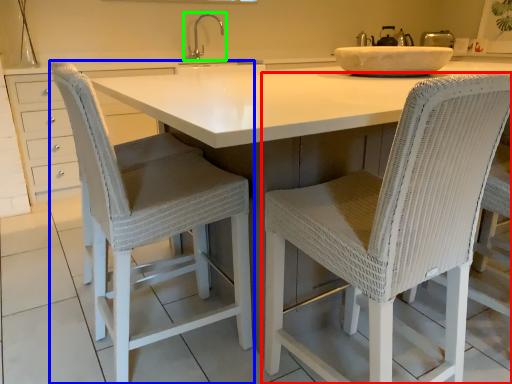
Question: Based on their relative distances, which object is farther from chair (highlighted by a red box)? Choose from chair (highlighted by a blue box) and tap (highlighted by a green box).

Choices:
 (A) chair
 (B) tap

Answer: (B)